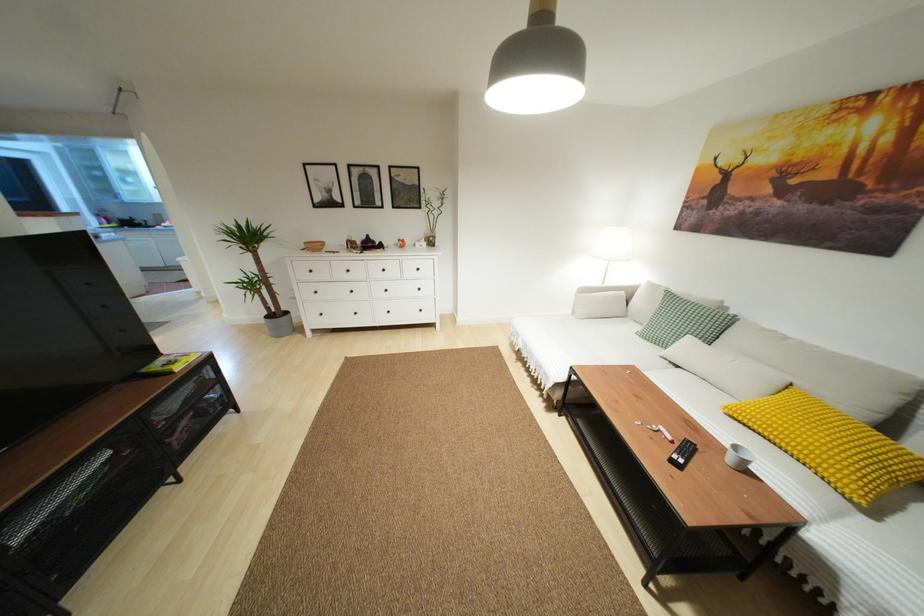
Where is `green checkered pillow`? The height and width of the screenshot is (616, 924). green checkered pillow is located at coordinates (673, 318).